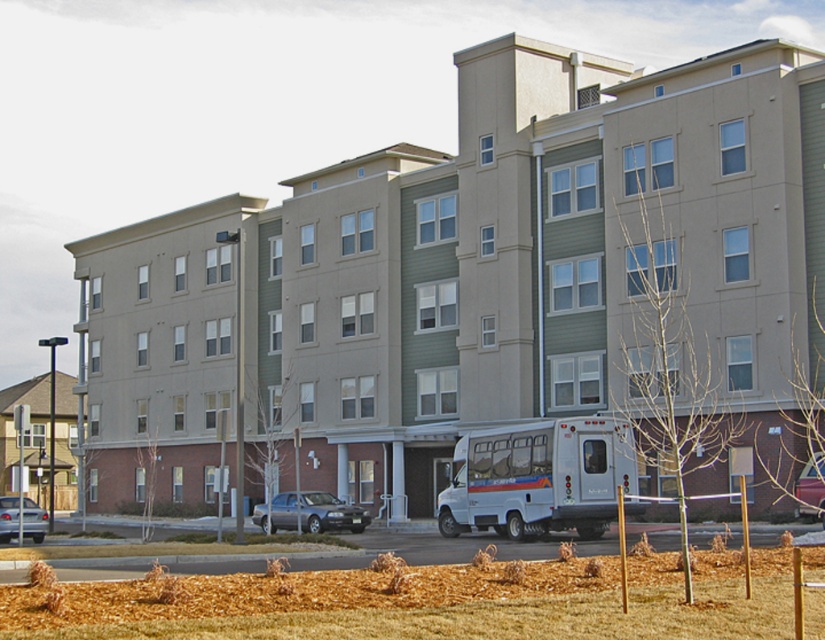
Does silver metallic sedan at center have a smaller size compared to metallic silver sedan at center?

No.

You are a GUI agent. You are given a task and a screenshot of the screen. Output one action in this format:
    pyautogui.click(x=<x>, y=<y>)
    Task: Click on the silver metallic sedan at center
    
    Given the screenshot: What is the action you would take?
    pyautogui.click(x=330, y=513)

Who is higher up, brown mulch at lower center or silver metallic sedan at lower left?

Positioned higher is brown mulch at lower center.

Can you confirm if brown mulch at lower center is bigger than silver metallic sedan at lower left?

Correct, brown mulch at lower center is larger in size than silver metallic sedan at lower left.

Does point (602, 612) come closer to viewer compared to point (22, 525)?

Yes, point (602, 612) is closer to viewer.

You are a GUI agent. You are given a task and a screenshot of the screen. Output one action in this format:
    pyautogui.click(x=<x>, y=<y>)
    Task: Click on the brown mulch at lower center
    The image size is (825, 640).
    Given the screenshot: What is the action you would take?
    (429, 602)

Does point (465, 529) come closer to viewer compared to point (819, 513)?

No, it is behind (819, 513).

Does white matte bus at lower center have a larger size compared to metallic silver sedan at center?

Yes, white matte bus at lower center is bigger than metallic silver sedan at center.

The height and width of the screenshot is (640, 825). What are the coordinates of `white matte bus at lower center` in the screenshot? It's located at (538, 477).